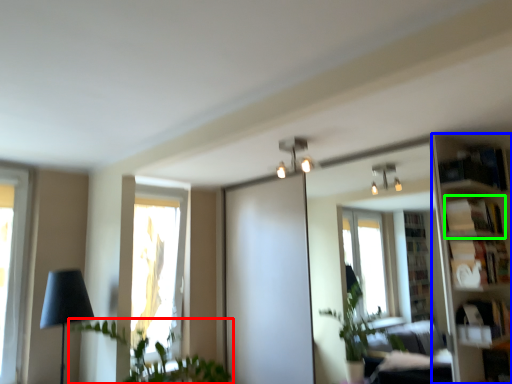
Question: Which object is the closest to the houseplant (highlighted by a red box)? Choose among these: bookshelf (highlighted by a blue box) or shelf (highlighted by a green box).

Choices:
 (A) bookshelf
 (B) shelf

Answer: (A)